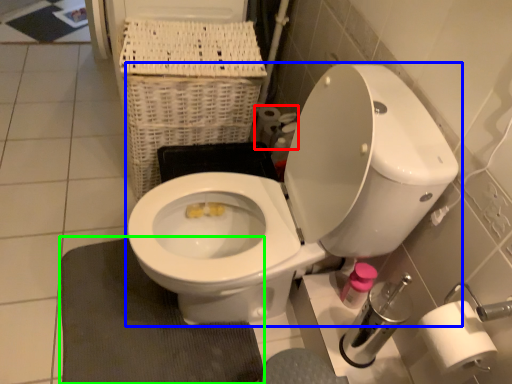
Question: Estimate the real-world distances between objects in this image. Which object is farther from toilet paper (highlighted by a red box), toilet (highlighted by a blue box) or bath mat (highlighted by a green box)?

Choices:
 (A) toilet
 (B) bath mat

Answer: (B)